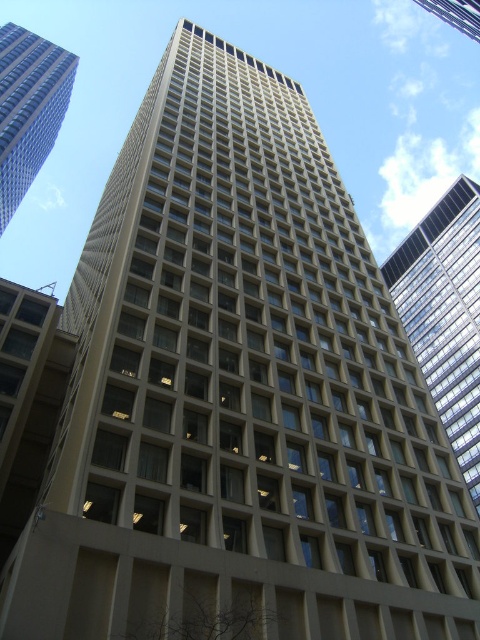
Question: Among these points, which one is farthest from the camera?

Choices:
 (A) click(414, 344)
 (B) click(48, 115)
 (C) click(45, 404)

Answer: (B)

Question: From the image, what is the correct spatial relationship of beige glass building at center in relation to beige glass windows at lower left?

Choices:
 (A) above
 (B) below

Answer: (A)

Question: Which object is closer to the camera taking this photo?

Choices:
 (A) beige glass windows at lower left
 (B) beige glass building at upper center
 (C) beige concrete building at upper left
 (D) beige glass building at center

Answer: (A)

Question: Does beige glass building at center appear over beige concrete building at upper left?

Choices:
 (A) no
 (B) yes

Answer: (A)

Question: Does beige glass building at center appear over beige concrete building at upper left?

Choices:
 (A) yes
 (B) no

Answer: (B)

Question: Which point is closer to the camera taking this photo?

Choices:
 (A) (440, 380)
 (B) (3, 51)
 (C) (29, 406)
 (D) (476, 3)

Answer: (C)